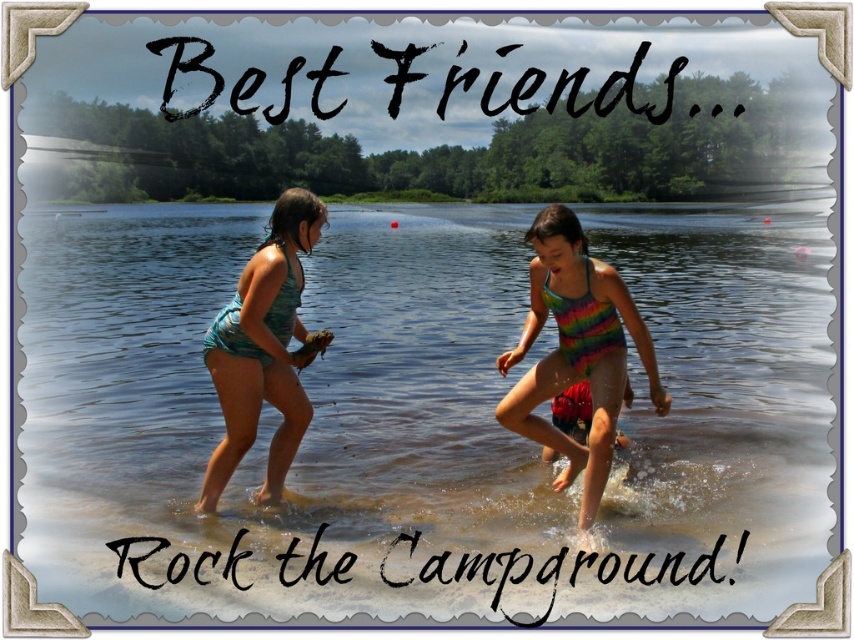
Does clear water at center have a lesser width compared to rainbow striped swimsuit at center?

Incorrect, clear water at center's width is not less than rainbow striped swimsuit at center's.

Does clear water at center appear on the right side of rainbow striped swimsuit at center?

In fact, clear water at center is to the left of rainbow striped swimsuit at center.

The image size is (854, 640). Identify the location of clear water at center. (423, 416).

Can you confirm if rainbow striped swimsuit at center is positioned above teal fabric swimsuit at left?

Indeed, rainbow striped swimsuit at center is positioned over teal fabric swimsuit at left.

Is point (642, 324) less distant than point (209, 371)?

No, it is not.

Between point (550, 371) and point (281, 483), which one is positioned in front?

Positioned in front is point (550, 371).

Identify the location of rainbow striped swimsuit at center. (576, 349).

Does clear water at center have a lesser height compared to teal fabric swimsuit at left?

In fact, clear water at center may be taller than teal fabric swimsuit at left.

Is the position of clear water at center less distant than that of teal fabric swimsuit at left?

Yes, it is.

Describe the element at coordinates (423, 416) in the screenshot. The image size is (854, 640). I see `clear water at center` at that location.

The height and width of the screenshot is (640, 854). I want to click on clear water at center, so click(x=423, y=416).